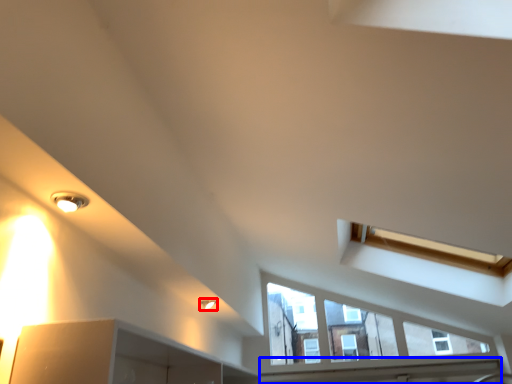
Question: Among these objects, which one is farthest to the camera, light fixture (highlighted by a red box) or window sill (highlighted by a blue box)?

Choices:
 (A) light fixture
 (B) window sill

Answer: (B)